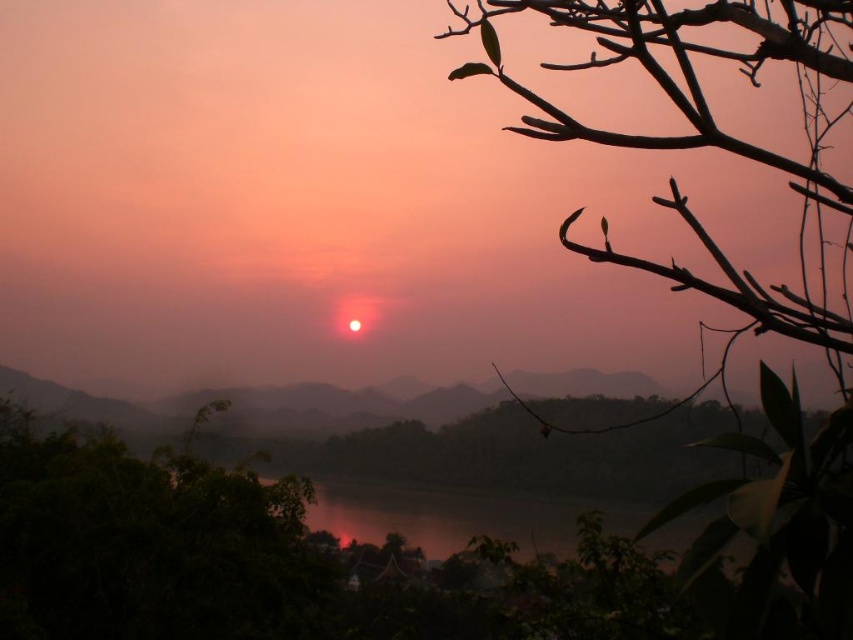
Is silhouette branch at upper right closer to the viewer compared to dark reflective water at center?

Yes, silhouette branch at upper right is in front of dark reflective water at center.

Does silhouette branch at upper right have a larger size compared to dark reflective water at center?

No, silhouette branch at upper right is not bigger than dark reflective water at center.

The height and width of the screenshot is (640, 853). In order to click on silhouette branch at upper right in this screenshot , I will do `click(764, 460)`.

This screenshot has height=640, width=853. Find the location of `silhouette branch at upper right`. silhouette branch at upper right is located at coordinates (764, 460).